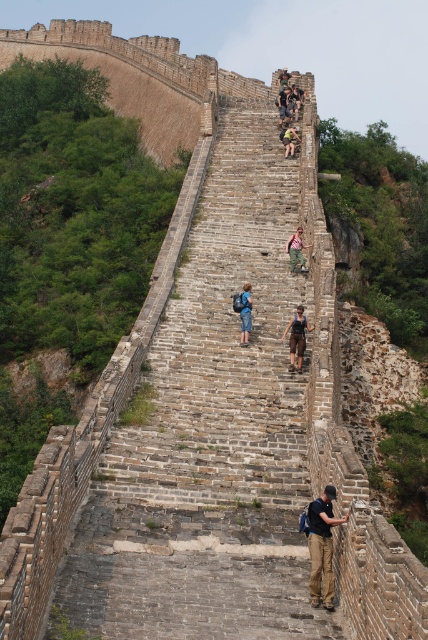
You are a hiker planning to walk along the Great Wall and see the dark brown leather pants at center and the green fabric backpack at upper center. How far apart are these two items?

The dark brown leather pants at center and the green fabric backpack at upper center are 58.48 meters apart from each other.